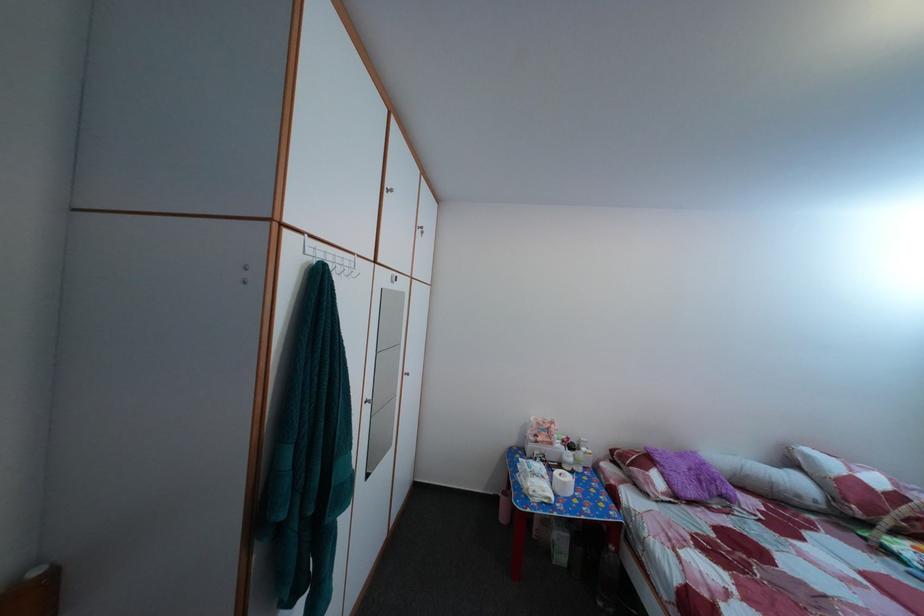
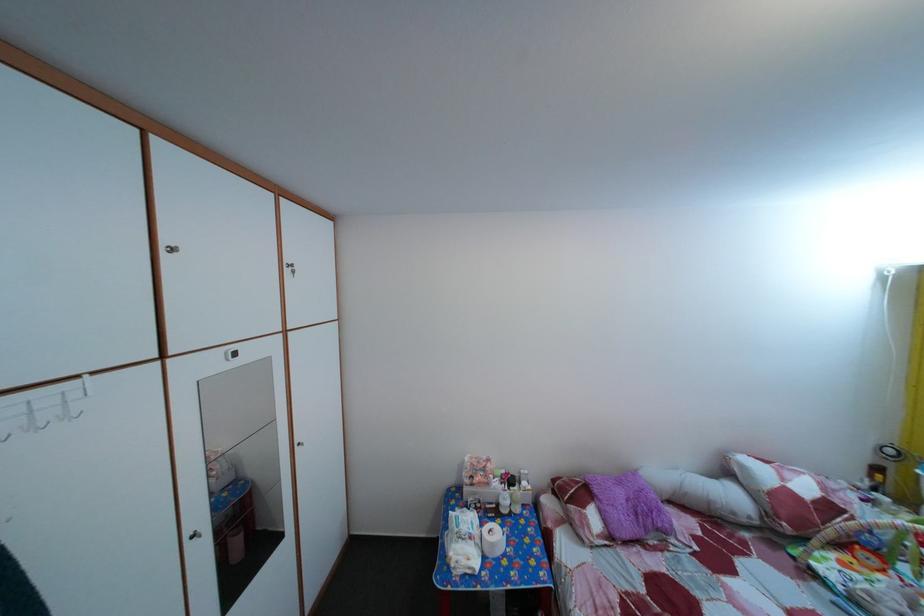
The point at (689, 464) is marked in the first image. Where is the corresponding point in the second image?

(629, 491)